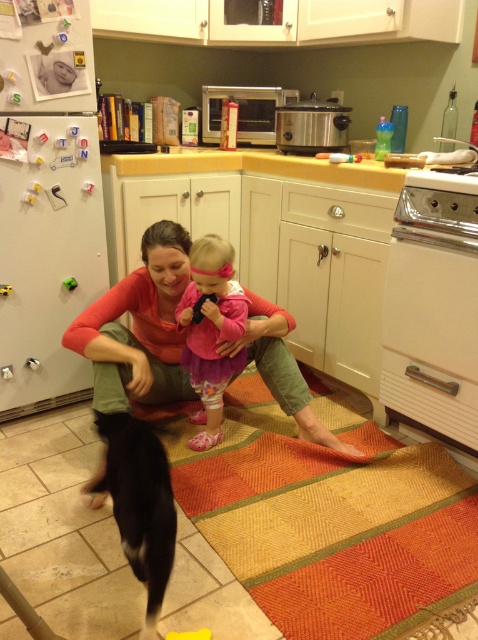
You are standing in the kitchen and see the point at coordinates (x=139, y=326). What object is located at that point?

The point at coordinates (x=139, y=326) indicates the matte orange shirt at center.

You are organizing a closet and see the matte orange shirt at center and the pink satin dress at center. Which item is located below the other?

The matte orange shirt at center is positioned under the pink satin dress at center, so the shirt is below the dress.

You are a photographer setting up a shoot in the kitchen scene described. You need to position a light source so that it illuminates the matte orange shirt at center without casting a shadow over the pink satin dress at center. Is this possible given their current arrangement?

The matte orange shirt at center is in front of the pink satin dress at center, so positioning the light source behind the matte orange shirt at center would illuminate it while casting its shadow towards the back. Since the pink satin dress at center is behind, the shadow might still fall on it. To avoid this, place the light source to the side of the matte orange shirt at center so the light comes from an angle, illuminating the shirt while directing the shadow away from the pink satin dress at center.